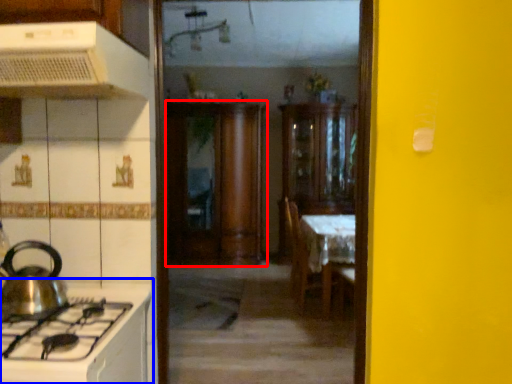
Question: Which object is further to the camera taking this photo, cabinetry (highlighted by a red box) or countertop (highlighted by a blue box)?

Choices:
 (A) cabinetry
 (B) countertop

Answer: (A)